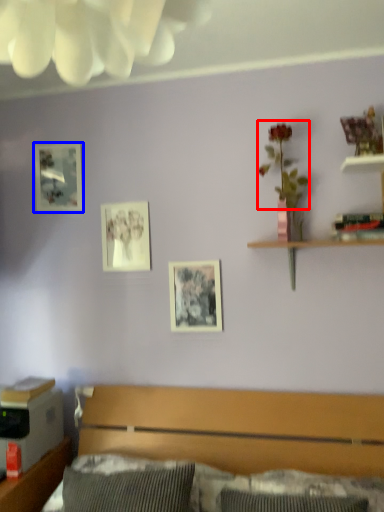
Question: Which of the following is the farthest to the observer, floral arrangement (highlighted by a red box) or picture frame (highlighted by a blue box)?

Choices:
 (A) floral arrangement
 (B) picture frame

Answer: (B)